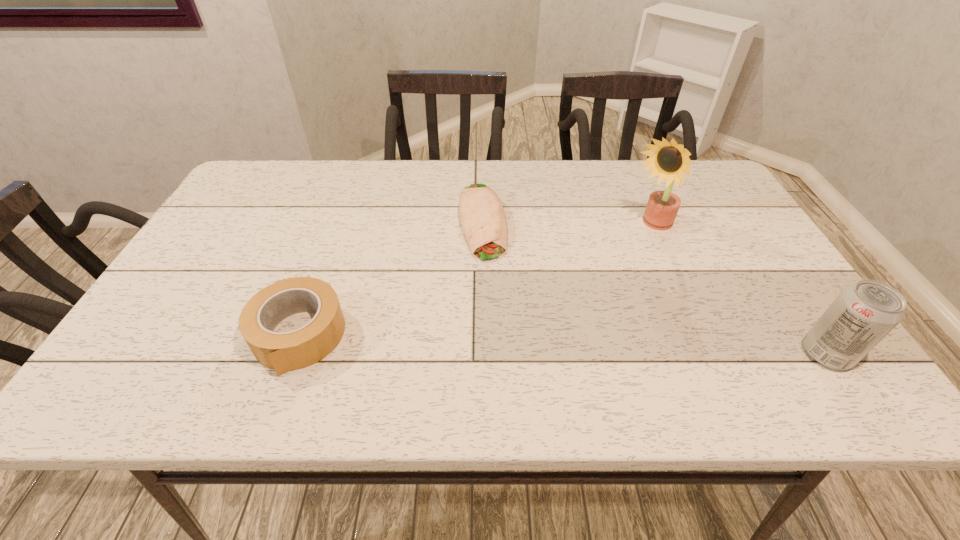
Locate an element on the screen. This screenshot has width=960, height=540. vacant space situated 0.100m at the bitten end of the second object from left to right is located at coordinates (492, 292).

Where is `vacant space situated 0.090m at the bitten end of the second object from left to right`? vacant space situated 0.090m at the bitten end of the second object from left to right is located at coordinates (492, 288).

Identify the location of vacant space located 0.060m on the face of the sunflower. This screenshot has height=540, width=960. (621, 250).

Locate an element on the screen. Image resolution: width=960 pixels, height=540 pixels. vacant space situated 0.140m on the face of the sunflower is located at coordinates (603, 265).

I want to click on free region located 0.350m on the face of the sunflower, so click(x=546, y=307).

At what (x,y) coordinates should I click in order to perform the action: click on object that is positioned at the far edge. Please return your answer as a coordinate pair (x, y). The height and width of the screenshot is (540, 960). Looking at the image, I should click on (483, 219).

Find the location of `duct tape that is at the near edge`. duct tape that is at the near edge is located at coordinates (282, 351).

Find the location of a particular element. The height and width of the screenshot is (540, 960). soda can that is positioned at the near edge is located at coordinates (864, 313).

This screenshot has height=540, width=960. I want to click on object that is at the right edge, so click(864, 313).

Locate an element on the screen. The image size is (960, 540). object positioned at the near right corner is located at coordinates (864, 313).